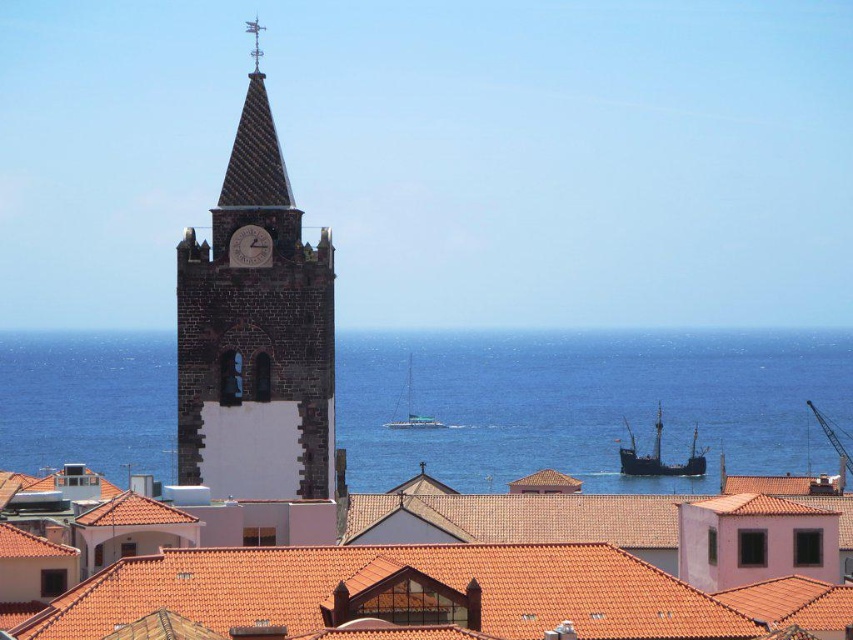
Does dark brown stone clock tower at left appear under matte stone clock at upper center?

Yes, dark brown stone clock tower at left is below matte stone clock at upper center.

Which is in front, point (280, 470) or point (233, 257)?

Point (280, 470) is more forward.

Which is in front, point (254, 118) or point (262, 244)?

Point (262, 244) is more forward.

The image size is (853, 640). I want to click on dark brown stone clock tower at left, so click(x=254, y=336).

Is matte stone clock at upper center wider than polished silver spire at upper center?

No, matte stone clock at upper center is not wider than polished silver spire at upper center.

Is matte stone clock at upper center thinner than polished silver spire at upper center?

Yes, matte stone clock at upper center is thinner than polished silver spire at upper center.

At what (x,y) coordinates should I click in order to perform the action: click on matte stone clock at upper center. Please return your answer as a coordinate pair (x, y). The width and height of the screenshot is (853, 640). Looking at the image, I should click on (250, 248).

Where is `matte stone clock at upper center`? matte stone clock at upper center is located at coordinates (250, 248).

Who is positioned more to the left, matte stone clock at upper center or white glossy sailboat at center?

matte stone clock at upper center is more to the left.

Consider the image. How far apart are matte stone clock at upper center and white glossy sailboat at center?

matte stone clock at upper center and white glossy sailboat at center are 189.22 meters apart.

Is point (265, 244) farther from viewer compared to point (413, 420)?

That is False.

Where is `matte stone clock at upper center`? The image size is (853, 640). matte stone clock at upper center is located at coordinates (250, 248).